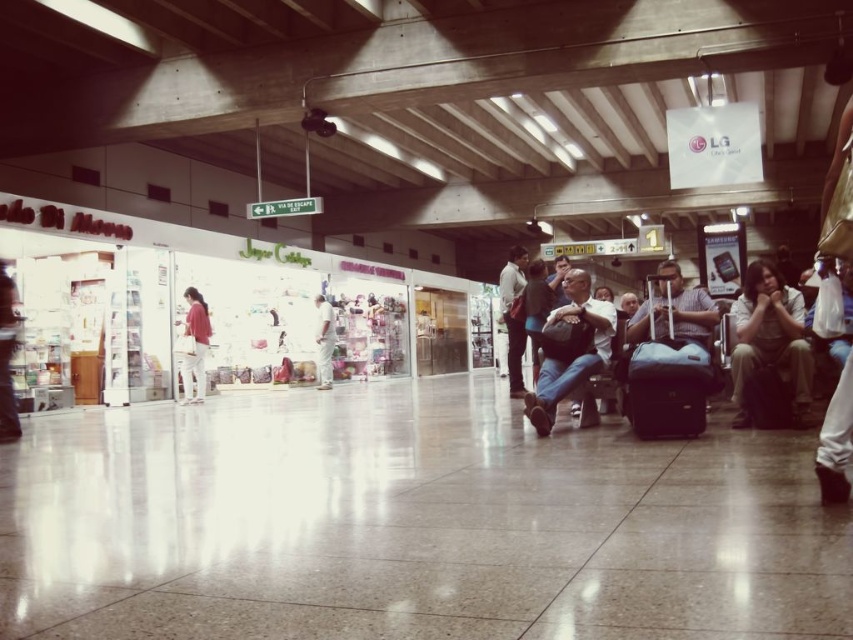
You are standing at the entrance of the train station and see both the light brown fabric pants at lower right and the dark blue jeans at center. Which pair of pants is closer to you?

The dark blue jeans at center is closer to you since it is only 2.32 meters away from the light brown fabric pants at lower right, but the question is about which is closer to you. Wait, the description says the light brown pants are 2.32 meters away from the dark blue jeans. Since you are at the entrance, the dark blue jeans at center would be closer because the distance between them is 2.32m, but without knowing their positions relative to the entrance, this might be ambiguous. Hmm, maybe I need to rework

You are standing in the train station and want to reach the two points marked in the scene. Which point, point (746, 326) or point (529, 284), is closer to you?

Point (746, 326) is closer to the viewer than point (529, 284).